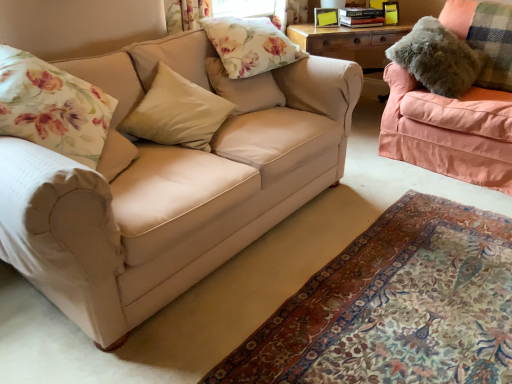
Question: Is point (312, 114) positioned closer to the camera than point (254, 92)?

Choices:
 (A) closer
 (B) farther

Answer: (A)

Question: In the image, is beige fabric couch at left, which appears as the 2th studio couch when viewed from the right, positioned in front of or behind floral fabric pillow at upper center, which ranks as the third pillow in left-to-right order?

Choices:
 (A) behind
 (B) front

Answer: (B)

Question: Estimate the real-world distances between objects in this image. Which object is farther from the fuzzy gray pillow at upper right, arranged as the 4th pillow when viewed from the left?

Choices:
 (A) beige fabric rug at lower center
 (B) beige fabric pillow at center, the third pillow in the right-to-left sequence
 (C) beige fabric couch at left, which appears as the 2th studio couch when viewed from the right
 (D) floral fabric pillow at left, placed as the first pillow when sorted from left to right
 (E) floral fabric pillow at upper center, marked as the second pillow in a right-to-left arrangement

Answer: (D)

Question: Estimate the real-world distances between objects in this image. Which object is closer to the pink fabric couch at right, which is counted as the 2th studio couch, starting from the left?

Choices:
 (A) fuzzy gray pillow at upper right, acting as the first pillow starting from the right
 (B) floral fabric pillow at left, placed as the fourth pillow when sorted from right to left
 (C) floral fabric pillow at upper center, which ranks as the third pillow in left-to-right order
 (D) beige fabric rug at lower center
 (E) beige fabric couch at left, which appears as the 2th studio couch when viewed from the right

Answer: (A)